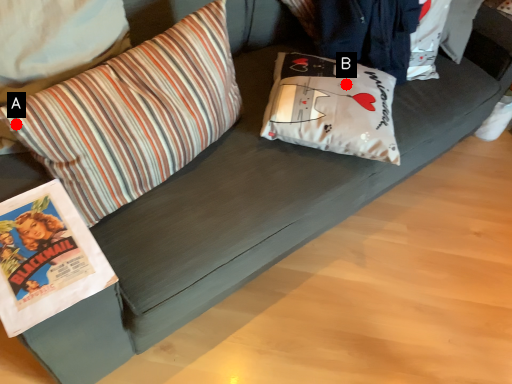
Question: Two points are circled on the image, labeled by A and B beside each circle. Which of the following is the farthest from the observer?

Choices:
 (A) A is further
 (B) B is further

Answer: (B)